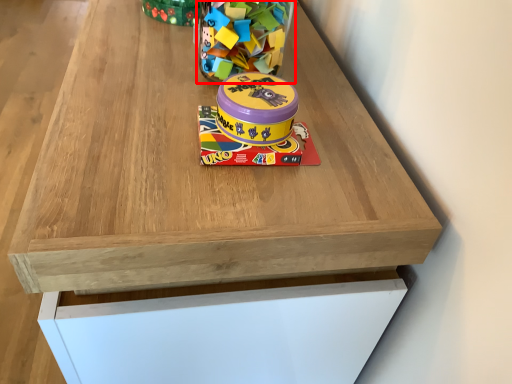
Question: From the image's perspective, where is toy (annotated by the red box) located relative to toy?

Choices:
 (A) below
 (B) above

Answer: (B)